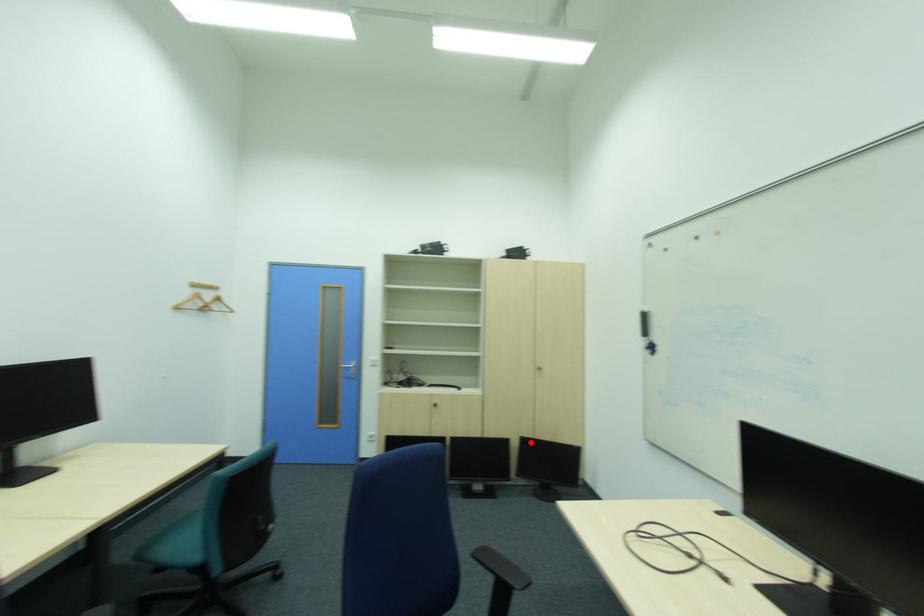
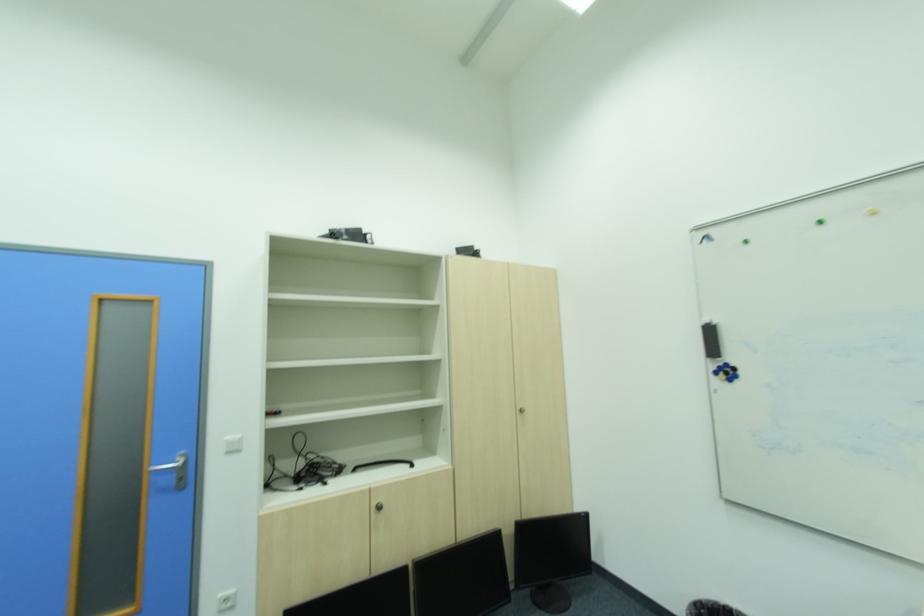
The point at the highlighted location is marked in the first image. Where is the corresponding point in the second image?

(531, 531)